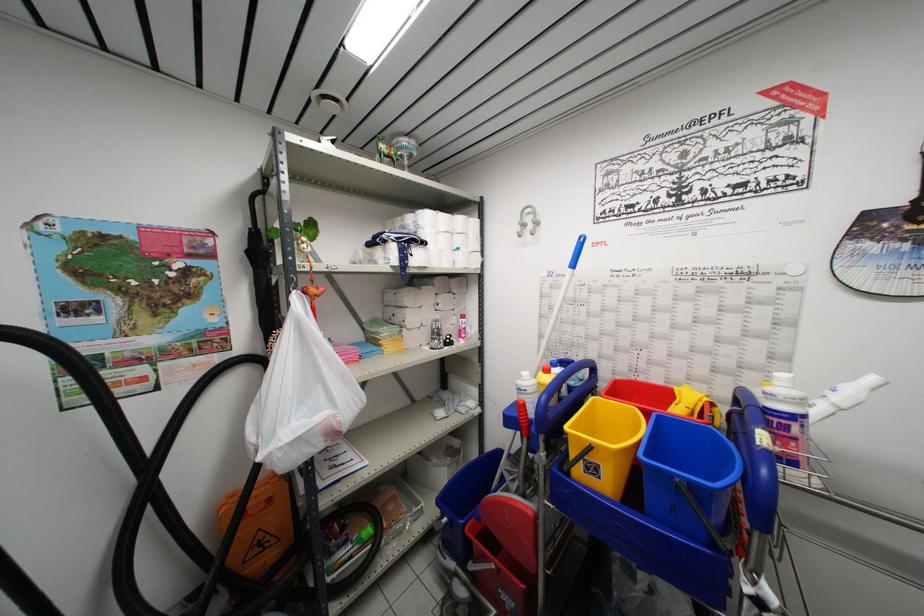
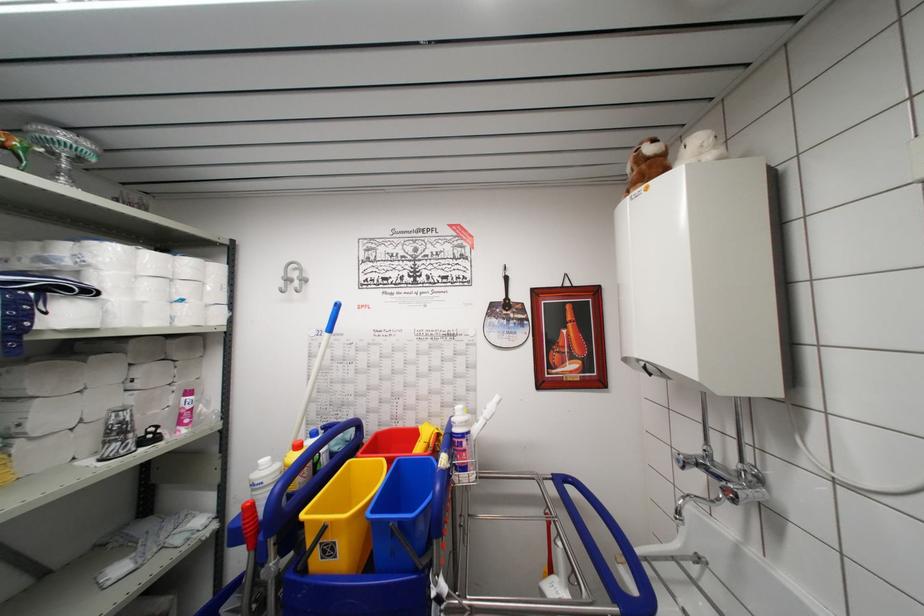
Question: I am providing you with two images of the same scene from different viewpoints. Which of the following objects are not visible in image2?

Choices:
 (A) blue bucket
 (B) black fan
 (C) red bucket
 (D) none of these

Answer: (D)